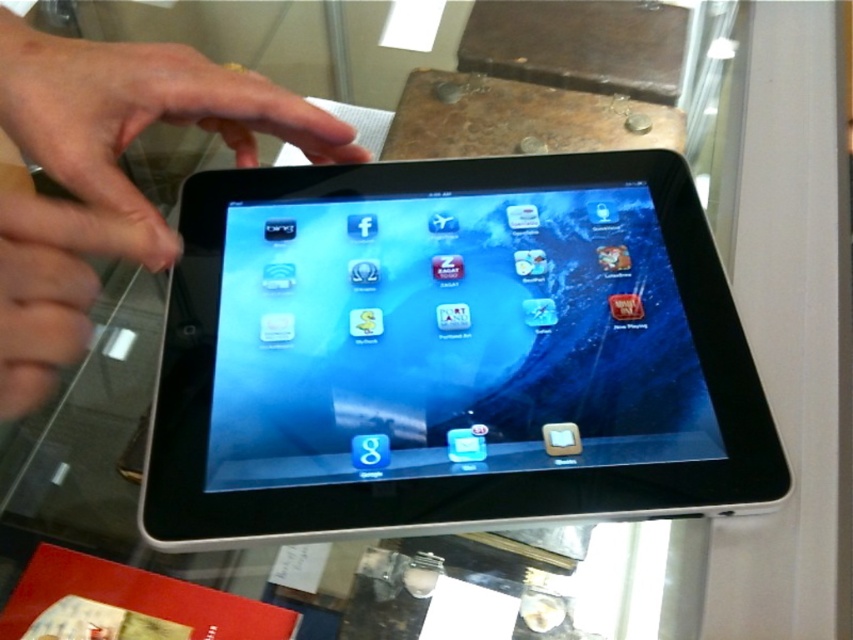
Question: Can you confirm if black glossy tablet at center is thinner than matte black tablet at center?

Choices:
 (A) no
 (B) yes

Answer: (A)

Question: Does black glossy tablet at center appear on the left side of matte black tablet at center?

Choices:
 (A) yes
 (B) no

Answer: (B)

Question: Is black glossy tablet at center bigger than matte black tablet at center?

Choices:
 (A) yes
 (B) no

Answer: (A)

Question: Which object is closer to the camera taking this photo?

Choices:
 (A) matte black tablet at center
 (B) black glossy tablet at center

Answer: (A)